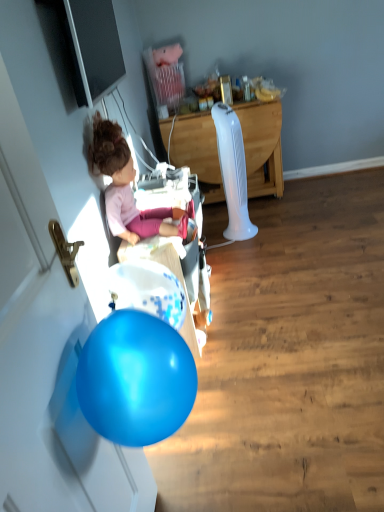
The height and width of the screenshot is (512, 384). Describe the element at coordinates (262, 146) in the screenshot. I see `white plastic fan at center` at that location.

This screenshot has height=512, width=384. Identify the location of white plastic fan at center. (262, 146).

Identify the location of matte pink doll at left. The width and height of the screenshot is (384, 512). (128, 189).

What do you see at coordinates (128, 189) in the screenshot?
I see `matte pink doll at left` at bounding box center [128, 189].

The width and height of the screenshot is (384, 512). Identify the location of white plastic fan at center. (262, 146).

Which object is positioned more to the left, matte pink doll at left or white plastic fan at center?

Positioned to the left is matte pink doll at left.

Consider the image. In the image, is matte pink doll at left positioned in front of or behind white plastic fan at center?

In the image, matte pink doll at left appears in front of white plastic fan at center.

Is point (114, 202) positioned in front of point (221, 179)?

Yes, point (114, 202) is in front of point (221, 179).

From the image's perspective, is matte pink doll at left positioned above or below white plastic fan at center?

matte pink doll at left is below white plastic fan at center.

From a real-world perspective, between matte pink doll at left and white plastic fan at center, who is vertically lower?

white plastic fan at center.

Is matte pink doll at left wider than white plastic fan at center?

In fact, matte pink doll at left might be narrower than white plastic fan at center.

In terms of height, does matte pink doll at left look taller or shorter compared to white plastic fan at center?

matte pink doll at left is shorter than white plastic fan at center.

In terms of size, does matte pink doll at left appear bigger or smaller than white plastic fan at center?

matte pink doll at left is smaller than white plastic fan at center.

Which is correct: matte pink doll at left is inside white plastic fan at center, or outside of it?

matte pink doll at left is located beyond the bounds of white plastic fan at center.

Is the surface of matte pink doll at left in direct contact with white plastic fan at center?

matte pink doll at left is not next to white plastic fan at center, and they're not touching.

Is matte pink doll at left looking in the opposite direction of white plastic fan at center?

That's not correct — matte pink doll at left is not looking away from white plastic fan at center.

Locate an element on the screen. Image resolution: width=384 pixels, height=512 pixels. desk behind the matte pink doll at left is located at coordinates (262, 146).

Can you confirm if white plastic fan at center is positioned to the left of matte pink doll at left?

No.

Is white plastic fan at center positioned in front of matte pink doll at left?

No, it is behind matte pink doll at left.

Which point is more distant from viewer, (258, 185) or (117, 176)?

The point (258, 185) is more distant.

From the image's perspective, who appears lower, white plastic fan at center or matte pink doll at left?

matte pink doll at left appears lower in the image.

From a real-world perspective, is white plastic fan at center positioned above or below matte pink doll at left?

white plastic fan at center is below matte pink doll at left.

Considering the sizes of objects white plastic fan at center and matte pink doll at left in the image provided, who is wider, white plastic fan at center or matte pink doll at left?

white plastic fan at center is wider.

In terms of height, does white plastic fan at center look taller or shorter compared to matte pink doll at left?

white plastic fan at center is taller than matte pink doll at left.

Based on the photo, is white plastic fan at center bigger than matte pink doll at left?

Indeed, white plastic fan at center has a larger size compared to matte pink doll at left.

In the scene shown: Is white plastic fan at center spatially inside matte pink doll at left, or outside of it?

white plastic fan at center lies outside matte pink doll at left.

Are white plastic fan at center and matte pink doll at left far apart?

Yes, white plastic fan at center and matte pink doll at left are located far from each other.

Is white plastic fan at center aimed at matte pink doll at left?

Yes, white plastic fan at center is turned towards matte pink doll at left.

Can you tell me how much white plastic fan at center and matte pink doll at left differ in facing direction?

The angle between the facing direction of white plastic fan at center and the facing direction of matte pink doll at left is 88.8 degrees.

This screenshot has width=384, height=512. Find the location of `desk on the right of matte pink doll at left`. desk on the right of matte pink doll at left is located at coordinates (262, 146).

You are a GUI agent. You are given a task and a screenshot of the screen. Output one action in this format:
    pyautogui.click(x=<x>, y=<y>)
    Task: Click on the desk behind the matte pink doll at left
    Image resolution: width=384 pixels, height=512 pixels.
    Given the screenshot: What is the action you would take?
    pyautogui.click(x=262, y=146)

Locate an element on the screen. This screenshot has width=384, height=512. person that is in front of the white plastic fan at center is located at coordinates (128, 189).